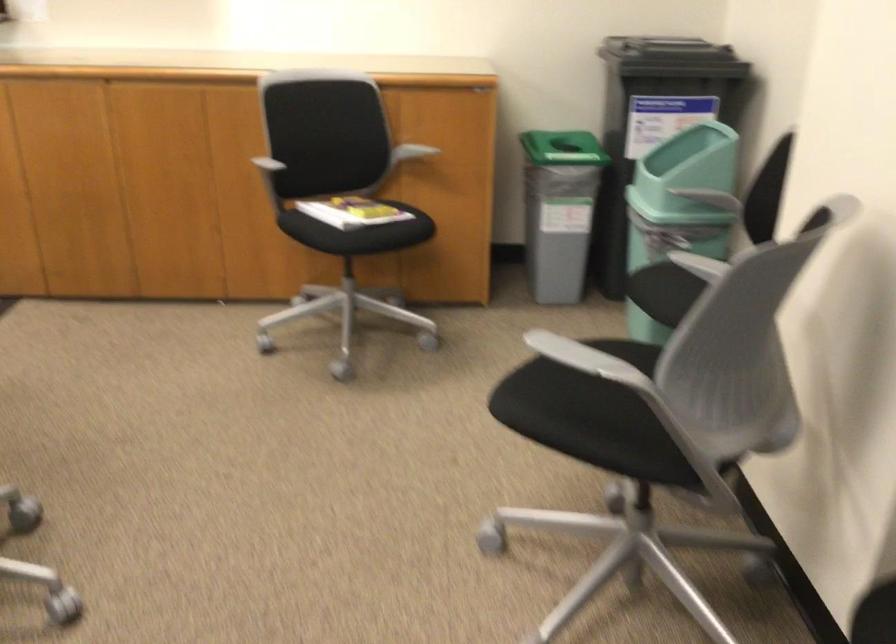
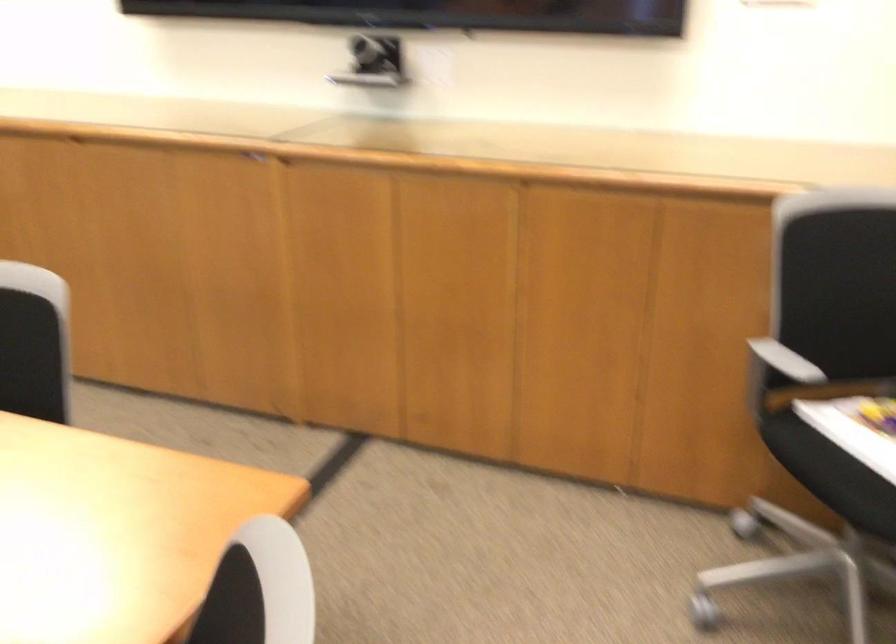
Find the pixel in the second image that matches pixel 270 169 in the first image.

(778, 374)